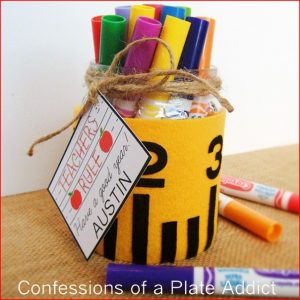
Where is `marker cap`? This screenshot has width=300, height=300. marker cap is located at coordinates (172, 277).